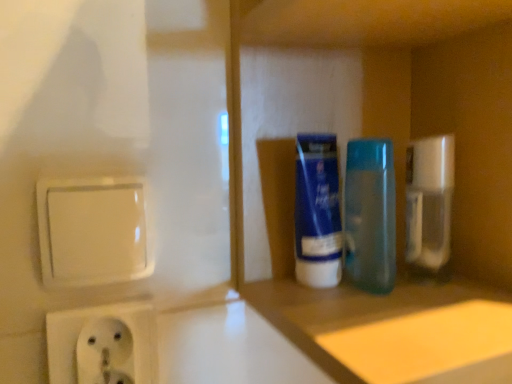
Question: Is clear plastic spray bottle at right taller or shorter than blue plastic bottles at center?

Choices:
 (A) tall
 (B) short

Answer: (B)

Question: Is point (415, 178) positioned closer to the camera than point (485, 41)?

Choices:
 (A) farther
 (B) closer

Answer: (A)

Question: Which object is positioned closest to the white plastic socket at lower left?

Choices:
 (A) blue translucent bottle at center, the second mouthwash positioned from the left
 (B) blue glossy tube at center, which is the 2th mouthwash in right-to-left order
 (C) blue plastic bottles at center
 (D) clear plastic spray bottle at right

Answer: (B)

Question: Which object is the farthest from the blue plastic bottles at center?

Choices:
 (A) clear plastic spray bottle at right
 (B) blue glossy tube at center, which is the 2th mouthwash in right-to-left order
 (C) white plastic socket at lower left
 (D) blue translucent bottle at center, the second mouthwash positioned from the left

Answer: (C)